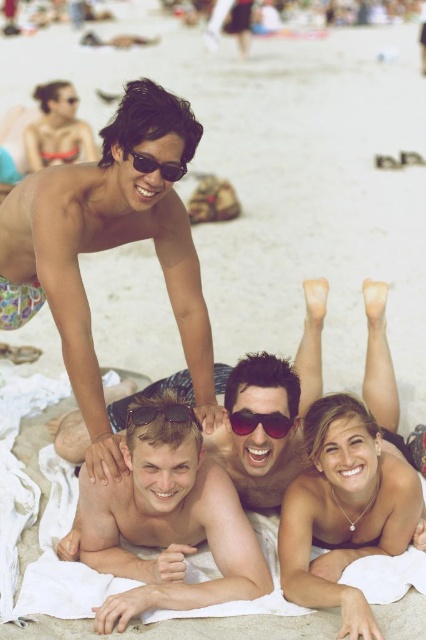
Question: Which object appears farthest from the camera in this image?

Choices:
 (A) multicolored swim trunks at upper center
 (B) sunglasses at center
 (C) shiny silver sunglasses at center

Answer: (B)

Question: Estimate the real-world distances between objects in this image. Which object is farther from the sunglasses at center?

Choices:
 (A) shiny silver sunglasses at center
 (B) black plastic sunglasses at center
 (C) multicolored swim trunks at upper center

Answer: (C)

Question: Is multicolored swim trunks at upper center positioned in front of matte black sunglasses at upper center?

Choices:
 (A) yes
 (B) no

Answer: (A)

Question: In this image, where is shiny silver sunglasses at center located relative to matte black sunglasses at upper center?

Choices:
 (A) left
 (B) right

Answer: (B)

Question: Which of these objects is positioned closest to the black plastic sunglasses at center?

Choices:
 (A) matte sunglasses at center
 (B) multicolored swim trunks at upper center

Answer: (A)

Question: Is sunglasses at center above matte black sunglasses at upper center?

Choices:
 (A) no
 (B) yes

Answer: (A)